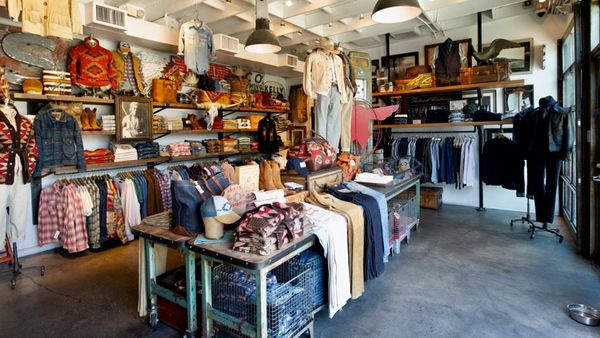
You are a GUI agent. You are given a task and a screenshot of the screen. Output one action in this format:
    pyautogui.click(x=<x>, y=<y>)
    Task: Click on the shelf
    The height and width of the screenshot is (338, 600).
    Given the screenshot: What is the action you would take?
    [107, 160]